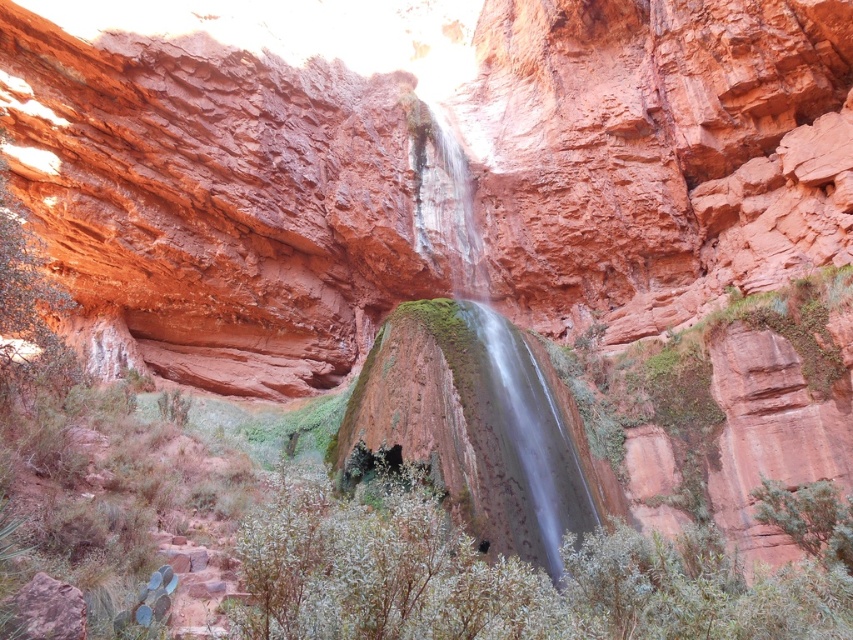
Is the position of green leafy shrubs at center less distant than that of smooth rock waterfall at center?

Yes, green leafy shrubs at center is in front of smooth rock waterfall at center.

Is point (717, 570) closer to viewer compared to point (479, 276)?

Yes, it is in front of point (479, 276).

Identify the location of green leafy shrubs at center. The image size is (853, 640). (503, 579).